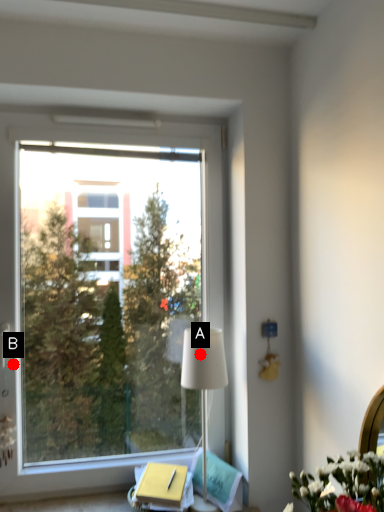
Question: Two points are circled on the image, labeled by A and B beside each circle. Which of the following is the farthest from the observer?

Choices:
 (A) A is further
 (B) B is further

Answer: (B)